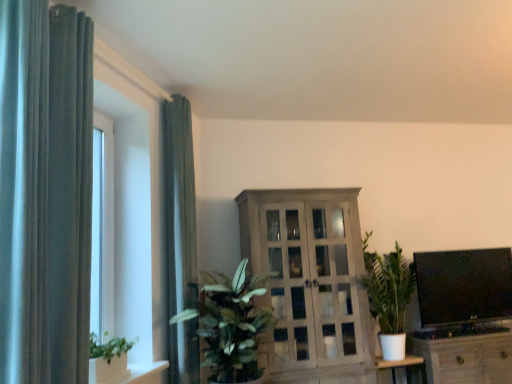
Question: Does wooden cabinet at center, which ranks as the second cabinetry in right-to-left order, lie behind green leafy plant at center?

Choices:
 (A) no
 (B) yes

Answer: (B)

Question: From the image's perspective, would you say wooden cabinet at center, acting as the first cabinetry starting from the left, is positioned over green leafy plant at center?

Choices:
 (A) no
 (B) yes

Answer: (B)

Question: Is wooden cabinet at center, acting as the first cabinetry starting from the left, shorter than green leafy plant at center?

Choices:
 (A) yes
 (B) no

Answer: (B)

Question: Can you confirm if wooden cabinet at center, which ranks as the second cabinetry in right-to-left order, is wider than green leafy plant at center?

Choices:
 (A) no
 (B) yes

Answer: (A)

Question: Is green leafy plant at center at the back of wooden cabinet at center, which ranks as the second cabinetry in right-to-left order?

Choices:
 (A) no
 (B) yes

Answer: (A)

Question: Is black glossy flat screen tv at right wider or thinner than green leafy plant at center?

Choices:
 (A) thin
 (B) wide

Answer: (A)

Question: Would you say black glossy flat screen tv at right is inside or outside green leafy plant at center?

Choices:
 (A) inside
 (B) outside

Answer: (B)

Question: Is black glossy flat screen tv at right to the left or to the right of green leafy plant at center in the image?

Choices:
 (A) right
 (B) left

Answer: (A)

Question: From their relative heights in the image, would you say black glossy flat screen tv at right is taller or shorter than green leafy plant at center?

Choices:
 (A) tall
 (B) short

Answer: (B)

Question: Is wooden cabinet at lower right, which appears as the second cabinetry when viewed from the left, in front of or behind matte gray curtain at left, which appears as the first curtain when viewed from the back, in the image?

Choices:
 (A) front
 (B) behind

Answer: (B)

Question: Is wooden cabinet at lower right, which appears as the second cabinetry when viewed from the left, taller or shorter than matte gray curtain at left, which appears as the first curtain when viewed from the back?

Choices:
 (A) tall
 (B) short

Answer: (B)

Question: Is wooden cabinet at lower right, which appears as the second cabinetry when viewed from the left, inside the boundaries of matte gray curtain at left, the 2th curtain viewed from the front, or outside?

Choices:
 (A) outside
 (B) inside

Answer: (A)

Question: Is point (503, 344) closer or farther from the camera than point (178, 324)?

Choices:
 (A) closer
 (B) farther

Answer: (B)

Question: Is black glossy flat screen tv at right inside the boundaries of wooden cabinet at lower right, which appears as the second cabinetry when viewed from the left, or outside?

Choices:
 (A) outside
 (B) inside

Answer: (A)

Question: Is black glossy flat screen tv at right wider or thinner than wooden cabinet at lower right, which appears as the second cabinetry when viewed from the left?

Choices:
 (A) wide
 (B) thin

Answer: (B)